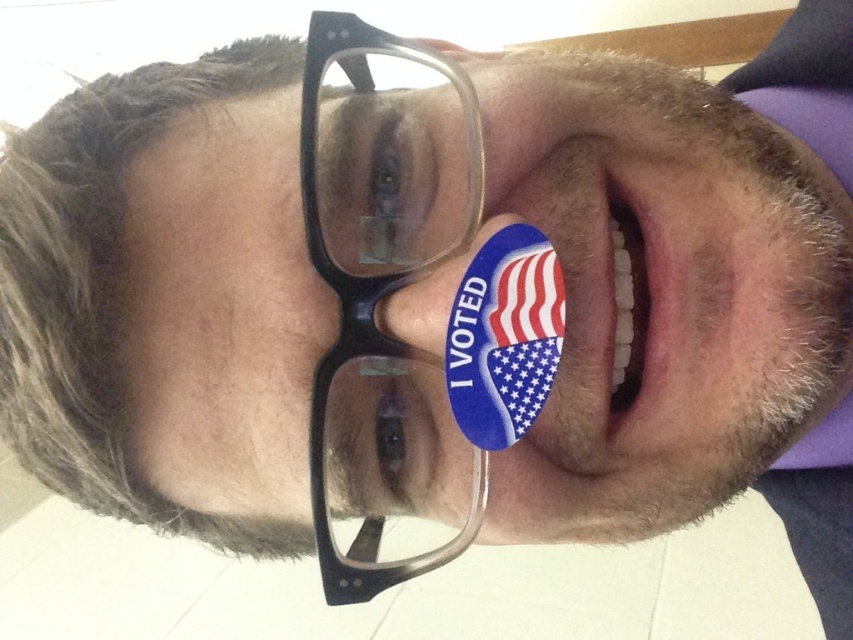
Does point (321, 131) come farther from viewer compared to point (642, 282)?

That is False.

Does black plastic glasses at center appear over white glossy teeth at center?

Actually, black plastic glasses at center is below white glossy teeth at center.

You are a GUI agent. You are given a task and a screenshot of the screen. Output one action in this format:
    pyautogui.click(x=<x>, y=<y>)
    Task: Click on the black plastic glasses at center
    The height and width of the screenshot is (640, 853).
    Given the screenshot: What is the action you would take?
    pyautogui.click(x=380, y=243)

Which is above, blue matte sticker at lower center or white glossy teeth at center?

white glossy teeth at center is higher up.

In the scene shown: Is blue matte sticker at lower center to the left of white glossy teeth at center from the viewer's perspective?

Correct, you'll find blue matte sticker at lower center to the left of white glossy teeth at center.

Is point (547, 268) positioned in front of point (633, 301)?

That is True.

You are a GUI agent. You are given a task and a screenshot of the screen. Output one action in this format:
    pyautogui.click(x=<x>, y=<y>)
    Task: Click on the blue matte sticker at lower center
    
    Given the screenshot: What is the action you would take?
    [503, 337]

Is the position of black plastic glasses at center less distant than that of blue matte sticker at lower center?

That is False.

Can you confirm if black plastic glasses at center is wider than blue matte sticker at lower center?

Yes, black plastic glasses at center is wider than blue matte sticker at lower center.

Which is in front, point (430, 131) or point (486, 378)?

Point (486, 378) is in front.

I want to click on black plastic glasses at center, so point(380,243).